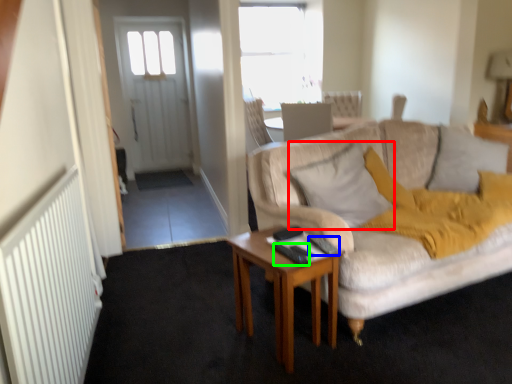
Question: Considering the real-world distances, which object is closest to pillow (highlighted by a red box)? remote control (highlighted by a blue box) or remote control (highlighted by a green box).

Choices:
 (A) remote control
 (B) remote control

Answer: (A)